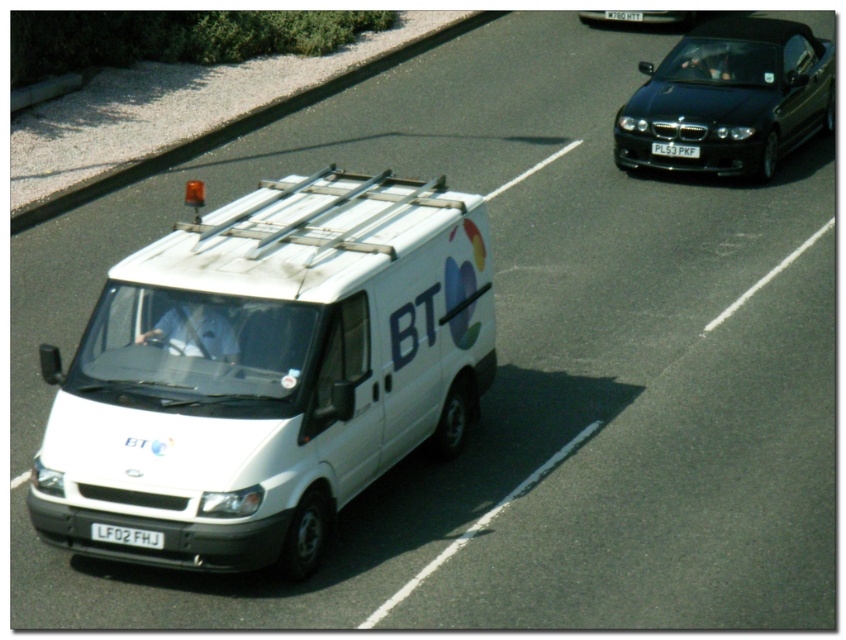
You are a passenger in the British Telecom van and want to know which of the two points, point [729,124] or point [605,17], is closer to you. Based on the scene, which point is nearer?

Point [729,124] is closer to the viewer than point [605,17], so it is nearer.

You are a traffic officer observing the road. You see the black glossy car at upper right and the black plastic license plate at center. Which object is closer to the front of the road?

The black glossy car at upper right is positioned under the black plastic license plate at center, meaning it is closer to the front of the road.